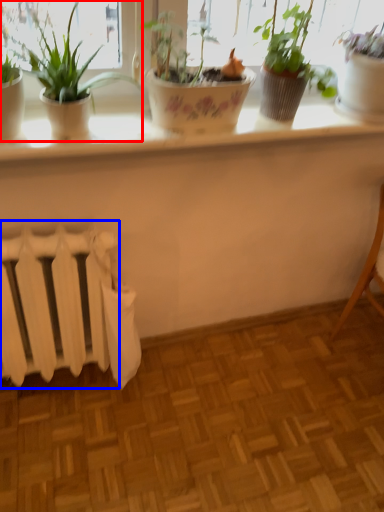
Question: Which point is further to the camera, houseplant (highlighted by a red box) or radiator (highlighted by a blue box)?

Choices:
 (A) houseplant
 (B) radiator

Answer: (B)